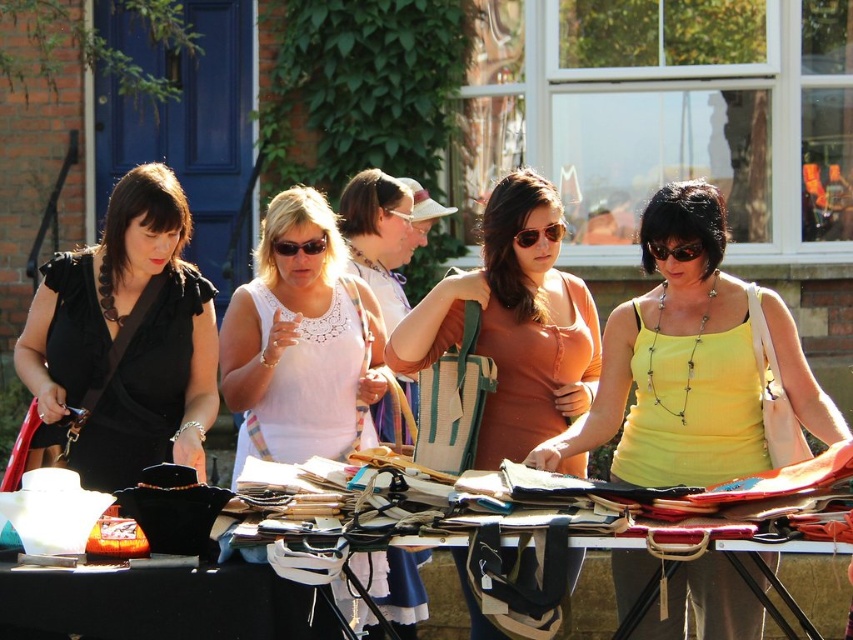
From the picture: You are a customer at the flea market and want to pick up the matte brown purse at center and the white plastic goggles at center. Which item should you move first to access the other?

The matte brown purse at center is in front of the white plastic goggles at center, so you should move the matte brown purse at center first to access the white plastic goggles at center.